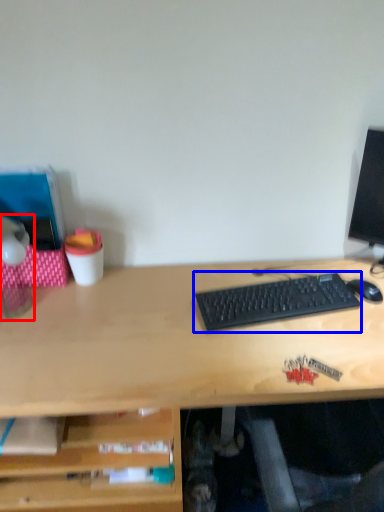
Question: Among these objects, which one is nearest to the camera, table lamp (highlighted by a red box) or computer keyboard (highlighted by a blue box)?

Choices:
 (A) table lamp
 (B) computer keyboard

Answer: (A)